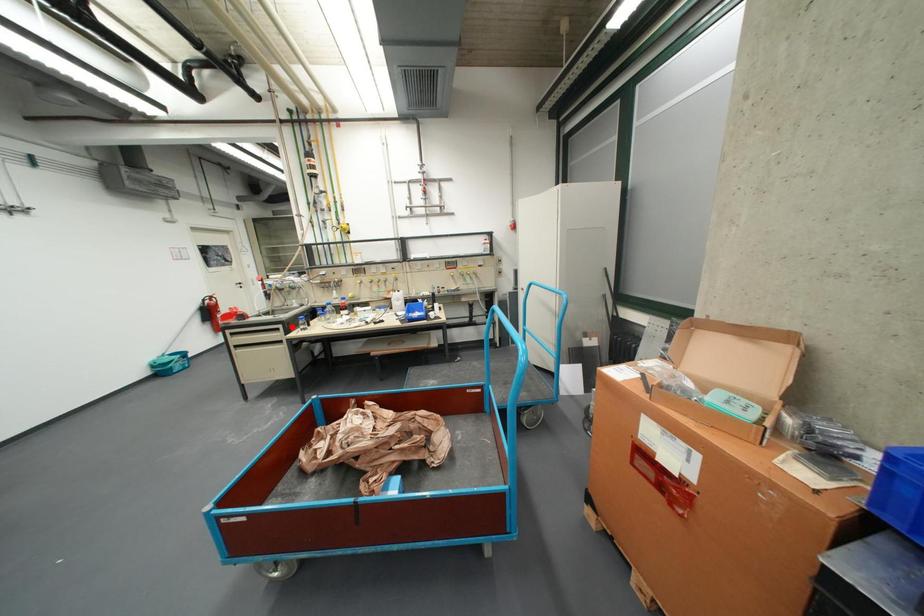
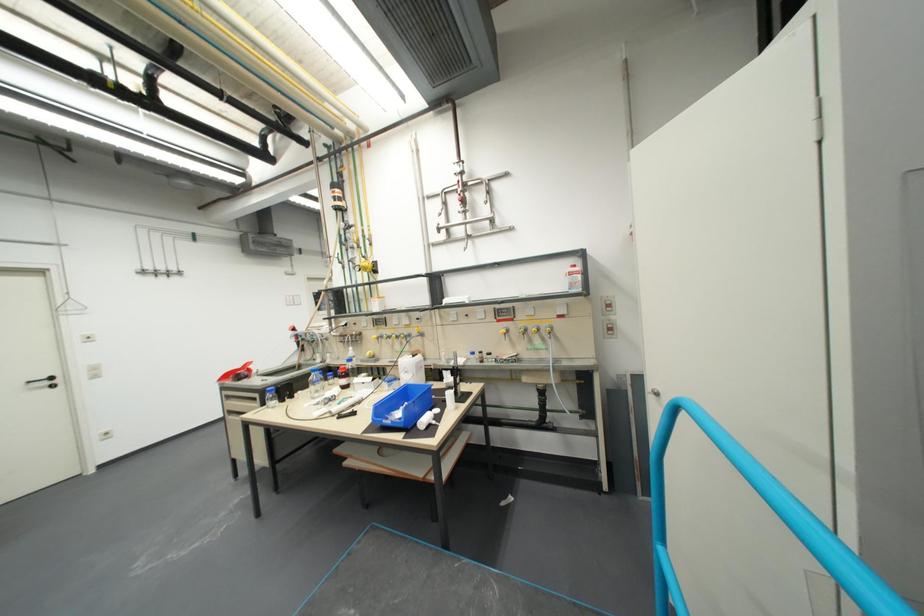
Locate, in the second image, the point that corresponds to the highlighted location in the first image.

(269, 397)